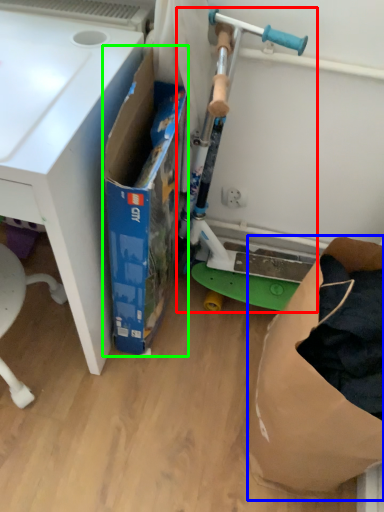
Question: Which is farther away from appliance (highlighted by a red box)? paper bag (highlighted by a blue box) or box (highlighted by a green box)?

Choices:
 (A) paper bag
 (B) box

Answer: (A)